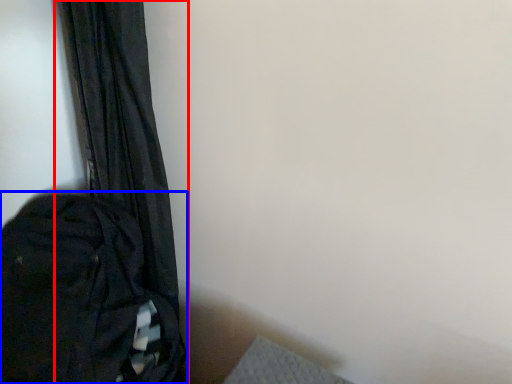
Question: Which point is further to the camera, curtain (highlighted by a red box) or backpack (highlighted by a blue box)?

Choices:
 (A) curtain
 (B) backpack

Answer: (A)